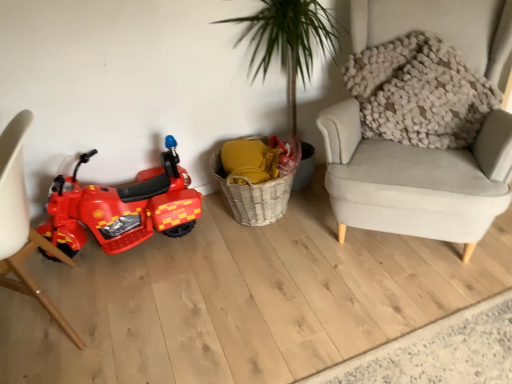
Where is `free space in front of shiny plastic toy motorcycle at left`? free space in front of shiny plastic toy motorcycle at left is located at coordinates (153, 304).